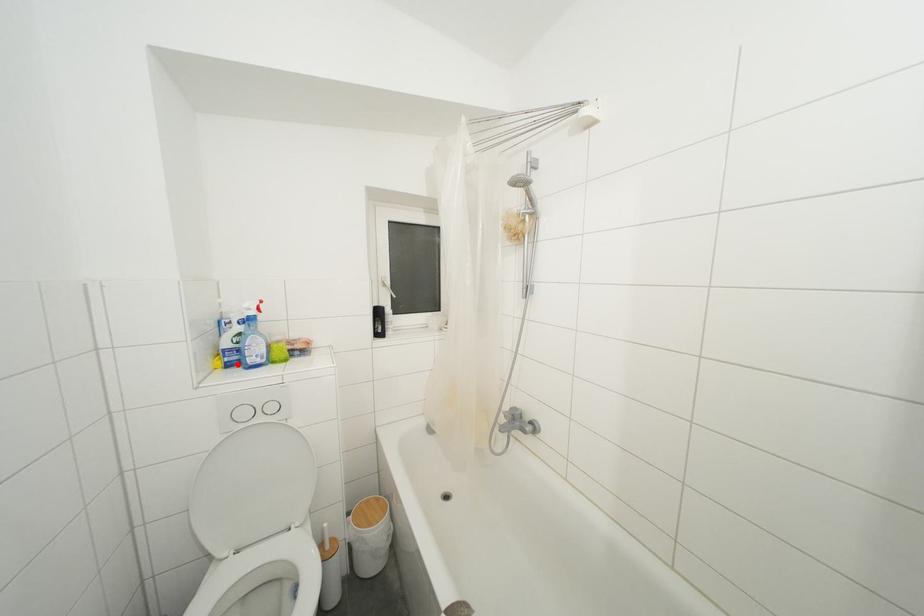
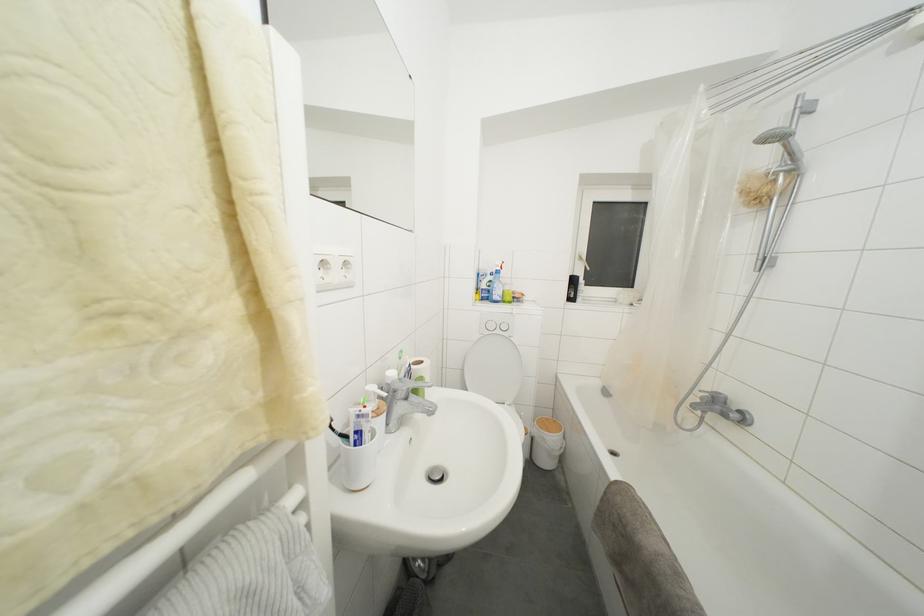
The point at the highlighted location is marked in the first image. Where is the corresponding point in the second image?

(490, 301)